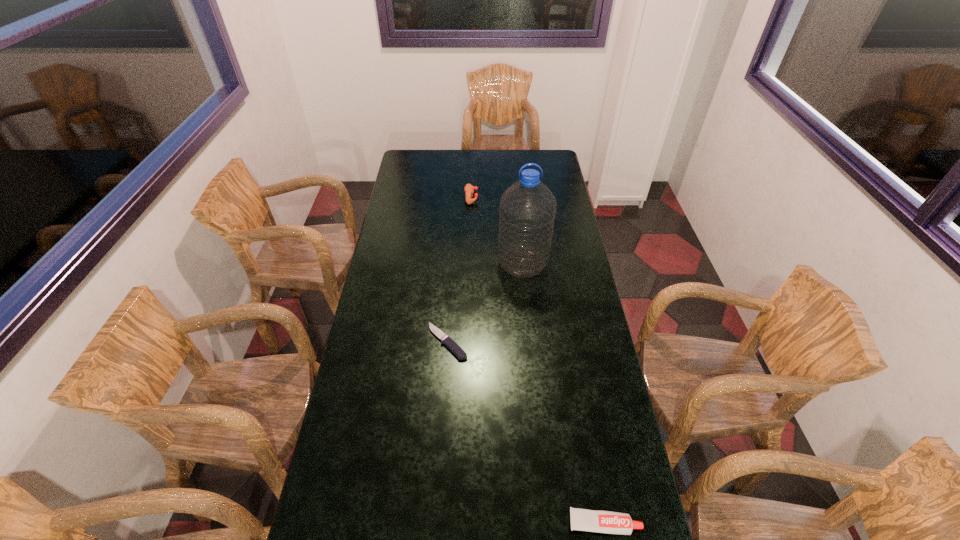
Where is `water jug`? The width and height of the screenshot is (960, 540). water jug is located at coordinates (527, 209).

The image size is (960, 540). In order to click on the second farthest object in this screenshot , I will do `click(527, 209)`.

This screenshot has height=540, width=960. Find the location of `puncher`. puncher is located at coordinates (469, 189).

The height and width of the screenshot is (540, 960). I want to click on the farthest object, so click(469, 189).

Where is `the nearest object`? This screenshot has width=960, height=540. the nearest object is located at coordinates (608, 522).

Identify the location of the second shortest object. This screenshot has width=960, height=540. (608, 522).

Locate an element on the screen. The image size is (960, 540). the third farthest object is located at coordinates (452, 345).

Locate an element on the screen. The image size is (960, 540). steak knife is located at coordinates (452, 345).

Find the location of a particular element. This screenshot has height=540, width=960. vacant position located on the left of the tallest object is located at coordinates (432, 264).

At what (x,y) coordinates should I click in order to perform the action: click on vacant space situated 0.160m with the gloves of the farthest object facing forward. Please return your answer as a coordinate pair (x, y). The image size is (960, 540). Looking at the image, I should click on (511, 197).